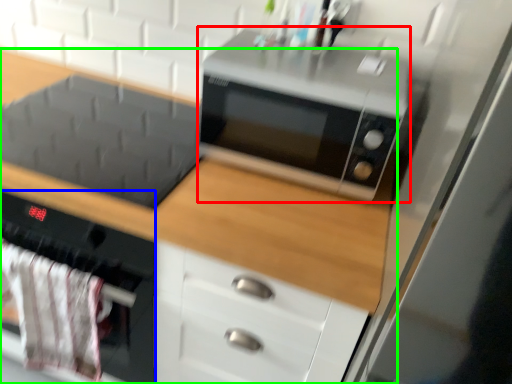
Question: Which object is the farthest from microwave oven (highlighted by a red box)? Choose among these: oven (highlighted by a blue box) or cabinetry (highlighted by a green box).

Choices:
 (A) oven
 (B) cabinetry

Answer: (A)